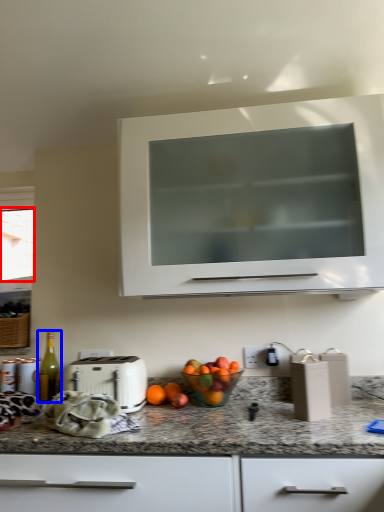
Question: Which of the following is the closest to the observer, window screen (highlighted by a red box) or bottle (highlighted by a blue box)?

Choices:
 (A) window screen
 (B) bottle

Answer: (B)